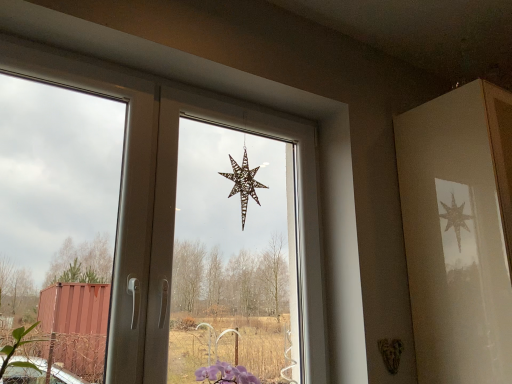
The image size is (512, 384). I want to click on metallic star at center, so click(174, 198).

Measure the distance between point (145, 277) and camera.

4.28 feet.

The image size is (512, 384). What do you see at coordinates (174, 198) in the screenshot? I see `metallic star at center` at bounding box center [174, 198].

Identify the location of metallic star at center. This screenshot has height=384, width=512. (174, 198).